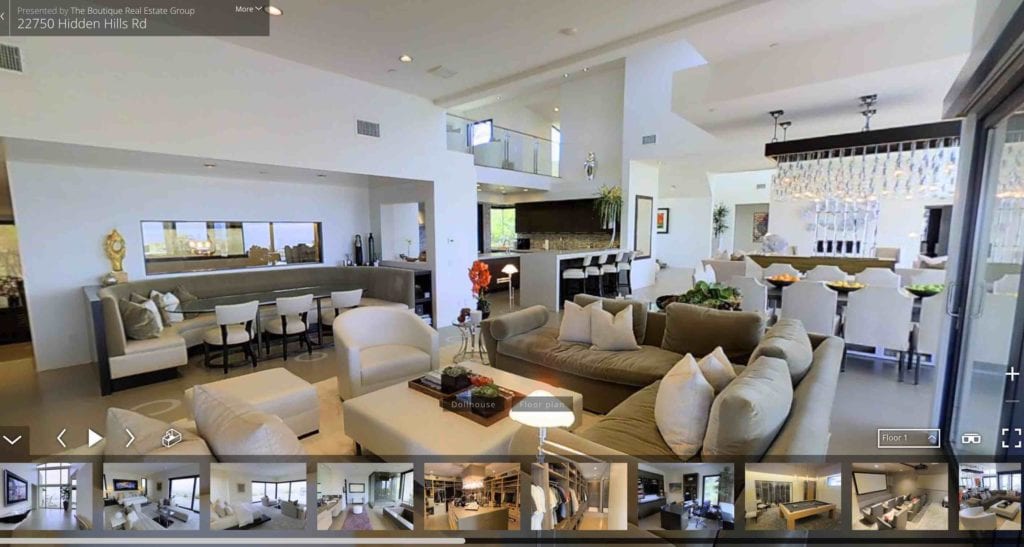
Find the location of `lighting decor`. lighting decor is located at coordinates (909, 162).